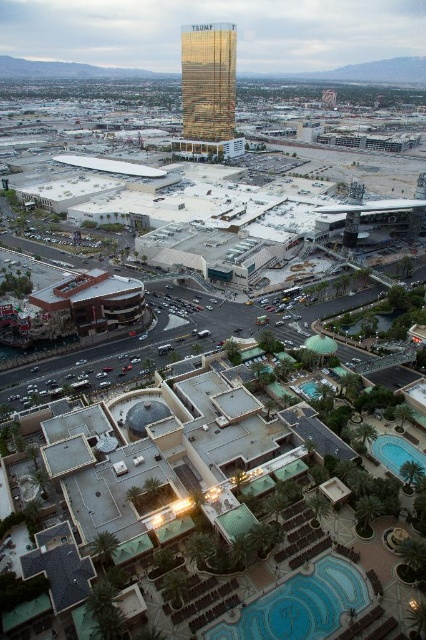
You are planning to take a photo of the gold reflective building at center and the blue glossy pool at lower right from the same distance. Which object will appear bigger in the photo?

The gold reflective building at center will appear bigger in the photo because it has a larger size compared to the blue glossy pool at lower right.

You are a drone operator trying to capture a photo of the gold reflective building at center and the blue glossy pool at lower right from above. Based on their positions, which object should you adjust your camera to focus on first if you want to capture both in a single frame?

The gold reflective building at center is to the left of the blue glossy pool at lower right, so you should focus on the gold reflective building at center first to ensure both are in frame.